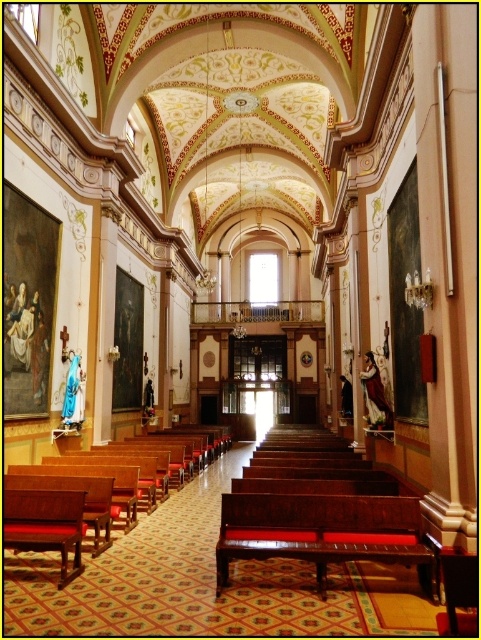
You are planning to place a large decorative cross in the church nave. Considering the space taken by the mahogany wood bench at center and the wooden polished bench at center, which bench would allow more room for the cross?

The wooden polished bench at center occupies more space than the mahogany wood bench at center, so placing the cross near the mahogany wood bench at center would leave more room for the cross.